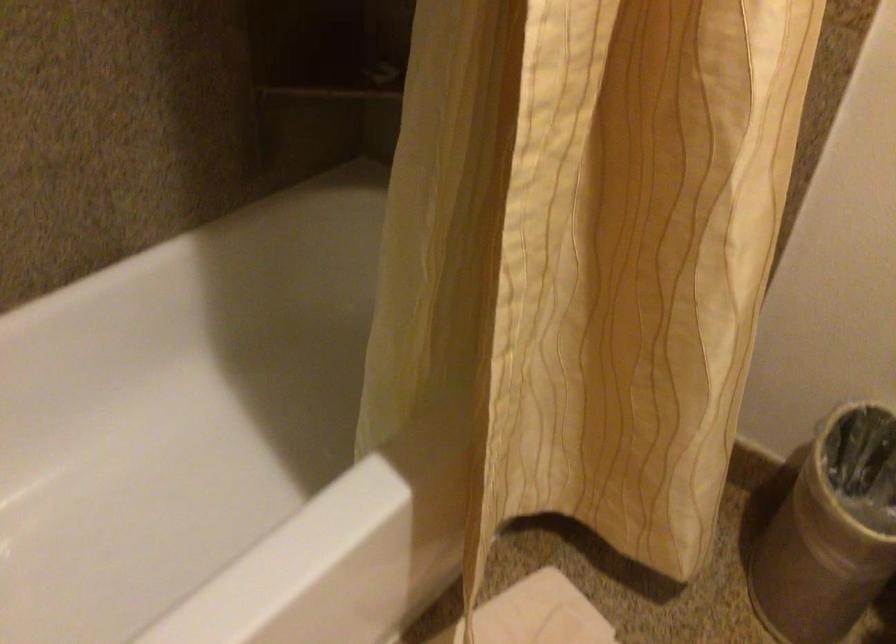
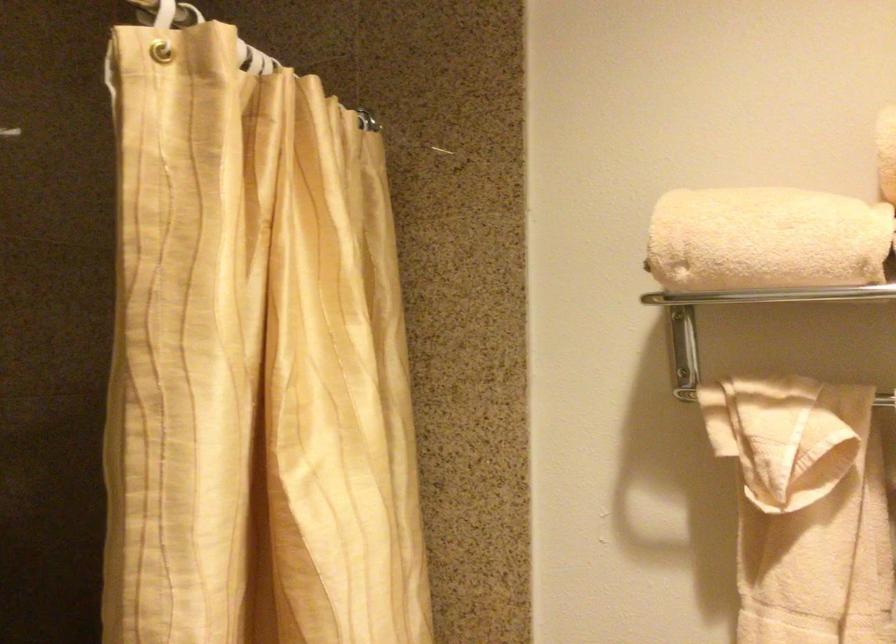
Question: Based on the continuous images, in which direction is the camera rotating? Reply with the corresponding letter.

Choices:
 (A) Left
 (B) Right
 (C) Up
 (D) Down

Answer: (C)